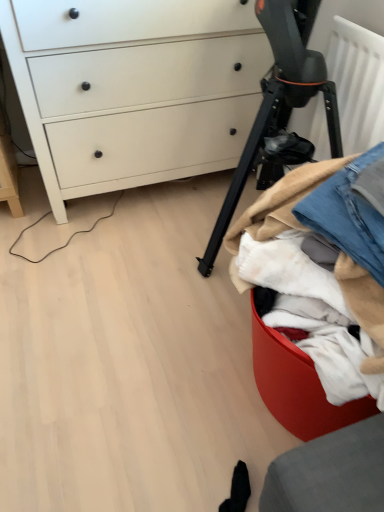
Question: Based on their sizes in the image, would you say white matte chest of drawers at upper left is bigger or smaller than black matte tripod at center?

Choices:
 (A) small
 (B) big

Answer: (B)

Question: Considering the positions of white matte chest of drawers at upper left and black matte tripod at center in the image, is white matte chest of drawers at upper left wider or thinner than black matte tripod at center?

Choices:
 (A) thin
 (B) wide

Answer: (B)

Question: Which object is the farthest from the white matte chest of drawers at upper left?

Choices:
 (A) black matte tripod at center
 (B) denim fabric at right
 (C) denim at right

Answer: (C)

Question: Based on their relative distances, which object is farther from the denim at right?

Choices:
 (A) denim fabric at right
 (B) white matte chest of drawers at upper left
 (C) black matte tripod at center

Answer: (B)